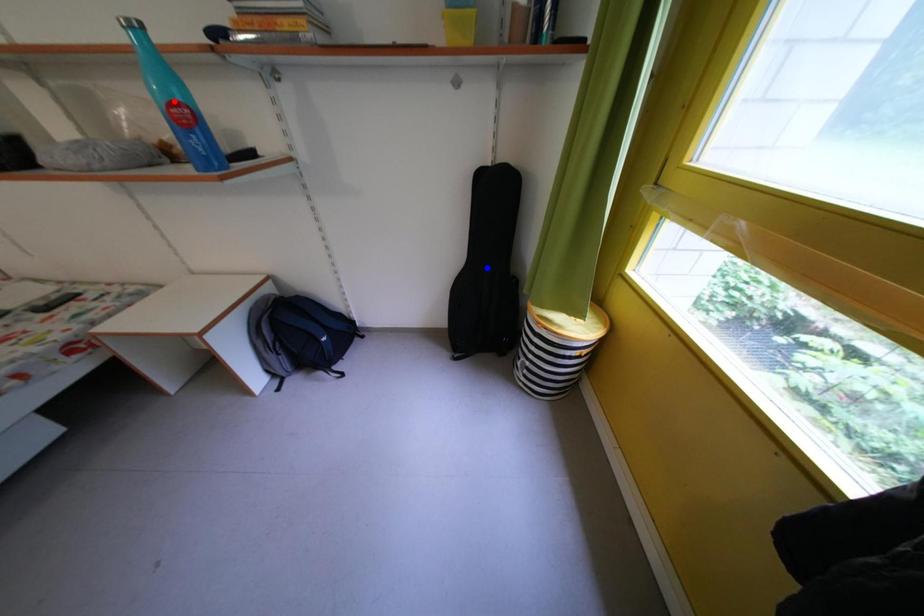
Question: In the image, two points are highlighted. Which point is nearer to the camera? Reply with the corresponding letter.

Choices:
 (A) blue point
 (B) red point

Answer: (B)